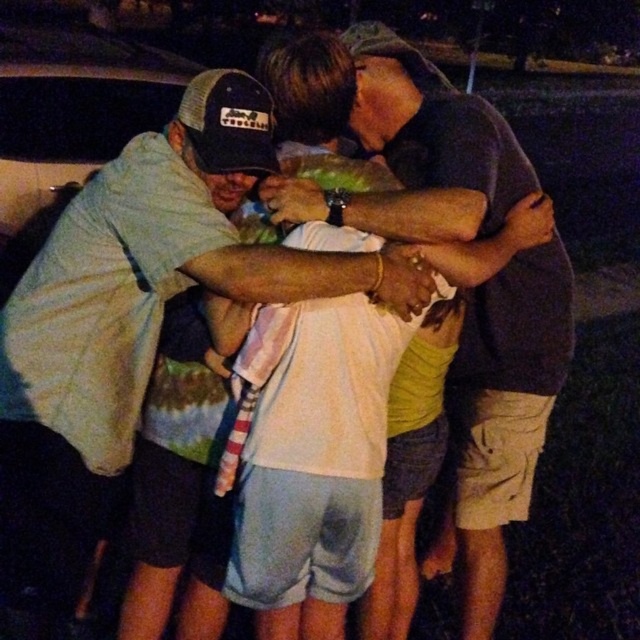
Describe the element at coordinates (140, 307) in the screenshot. I see `light blue shirt at center` at that location.

Does light blue shirt at center have a larger size compared to dark gray shirt at center?

Yes.

Measure the distance between point (124, 243) and camera.

They are 1.70 meters apart.

At what (x,y) coordinates should I click in order to perform the action: click on light blue shirt at center. Please return your answer as a coordinate pair (x, y). The height and width of the screenshot is (640, 640). Looking at the image, I should click on (140, 307).